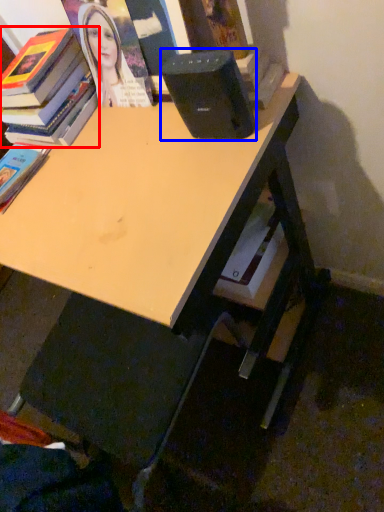
Question: Among these objects, which one is nearest to the camera, book (highlighted by a red box) or speaker (highlighted by a blue box)?

Choices:
 (A) book
 (B) speaker

Answer: (B)